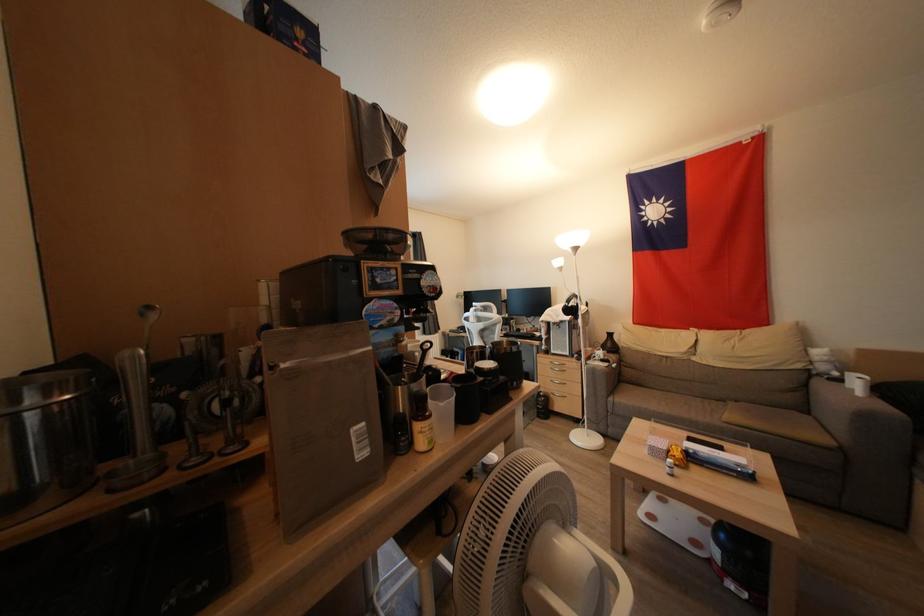
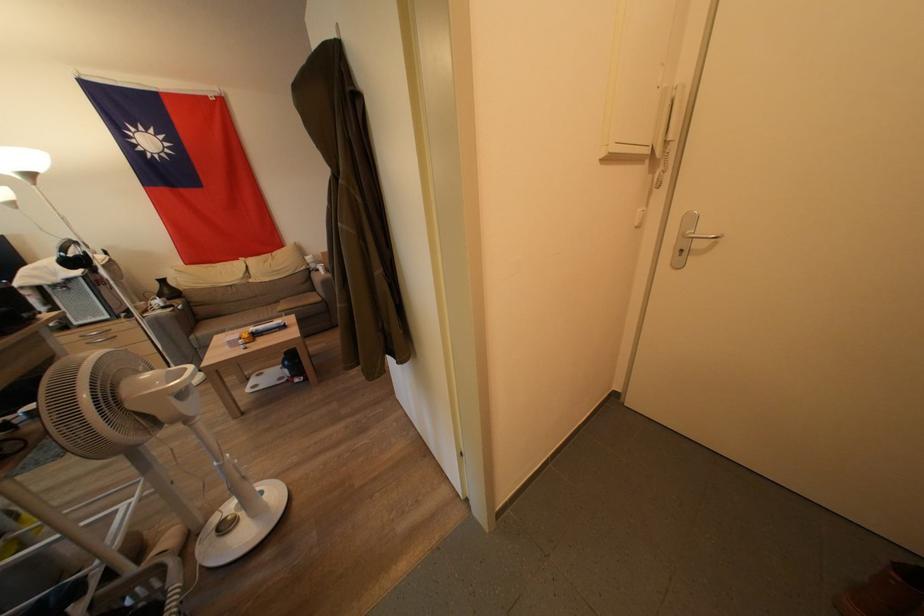
Locate, in the second image, the point that corresponds to point (621, 585) in the first image.

(190, 373)